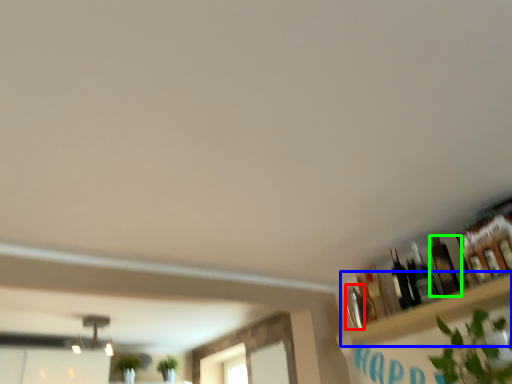
Question: Estimate the real-world distances between objects in this image. Which object is farther from bottle (highlighted by a red box), shelf (highlighted by a blue box) or bottle (highlighted by a green box)?

Choices:
 (A) shelf
 (B) bottle

Answer: (B)